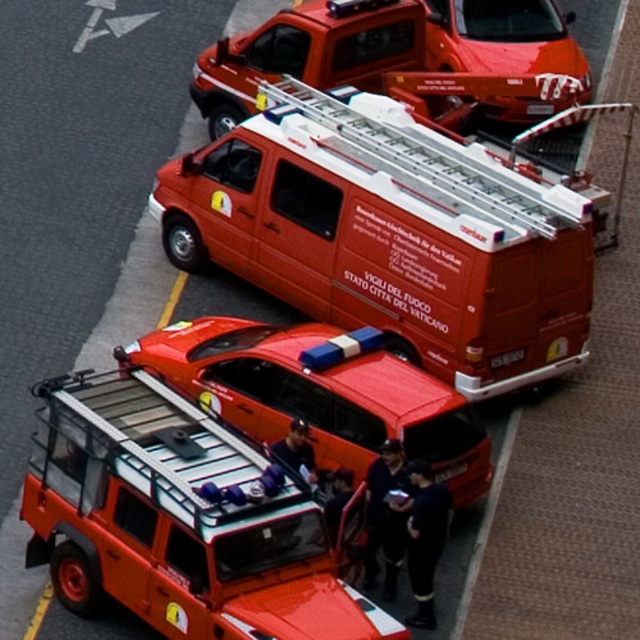
Does matte orange van at center appear on the right side of metallic red van at upper center?

In fact, matte orange van at center is to the left of metallic red van at upper center.

Is matte orange van at center below metallic red van at upper center?

Yes.

Locate an element on the screen. matte orange van at center is located at coordinates click(388, 237).

Is metallic red van at upper center below metallic red car at center?

No, metallic red van at upper center is not below metallic red car at center.

Is metallic red van at upper center to the right of metallic red car at center from the viewer's perspective?

Indeed, metallic red van at upper center is positioned on the right side of metallic red car at center.

Between point (346, 48) and point (346, 365), which one is positioned behind?

The point (346, 48) is more distant.

This screenshot has height=640, width=640. I want to click on metallic red van at upper center, so click(x=404, y=58).

Is matte orange van at center shorter than metallic silver ambulance at center?

Correct, matte orange van at center is not as tall as metallic silver ambulance at center.

Identify the location of matte orange van at center. (388, 237).